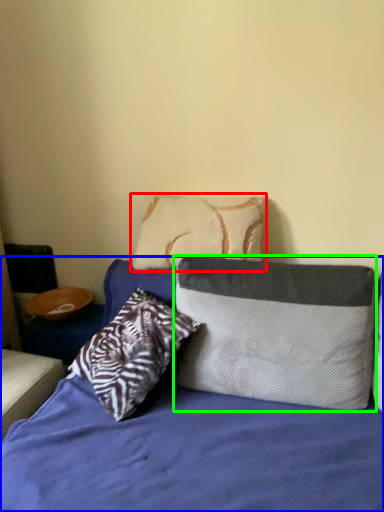
Question: Which object is positioned closest to pillow (highlighted by a red box)? Select from bed (highlighted by a blue box) and pillow (highlighted by a green box).

Choices:
 (A) bed
 (B) pillow

Answer: (B)